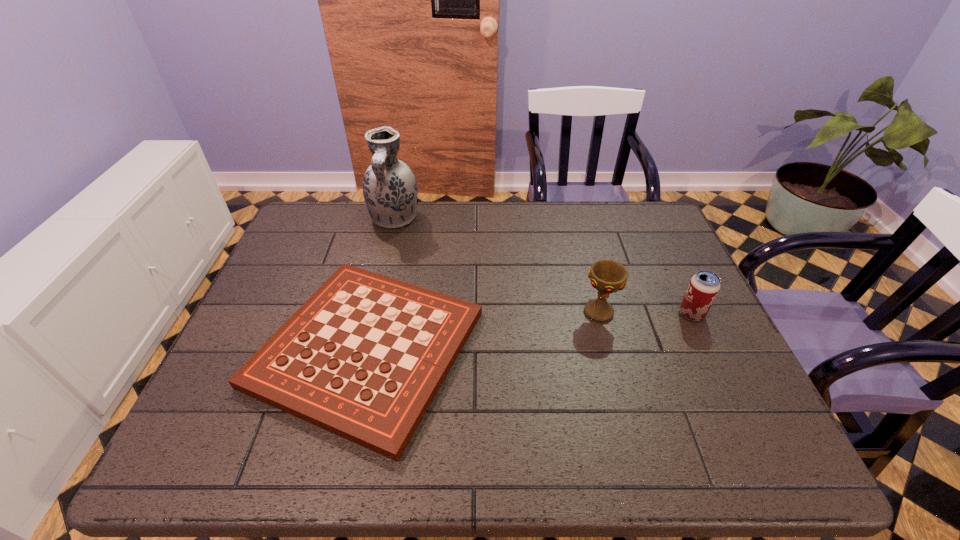
Identify the location of the farthest object. This screenshot has height=540, width=960. (390, 191).

Find the location of `vase`. vase is located at coordinates (390, 191).

Find the location of a particular element. the second object from right to left is located at coordinates (607, 276).

The height and width of the screenshot is (540, 960). Find the location of `beer can`. beer can is located at coordinates (704, 286).

Where is `gameboard`? The height and width of the screenshot is (540, 960). gameboard is located at coordinates (363, 358).

Locate an element on the screen. vacant position located 0.090m with the handle on the side of the farthest object is located at coordinates (386, 255).

This screenshot has width=960, height=540. In order to click on vacant space located on the front of the chalice in this screenshot , I will do `click(618, 384)`.

Image resolution: width=960 pixels, height=540 pixels. In order to click on vacant space located on the back of the beer can in this screenshot , I will do `click(653, 233)`.

This screenshot has height=540, width=960. In order to click on vacant space located on the back of the shortest object in this screenshot , I will do `click(389, 254)`.

This screenshot has width=960, height=540. I want to click on object at the far edge, so click(x=390, y=191).